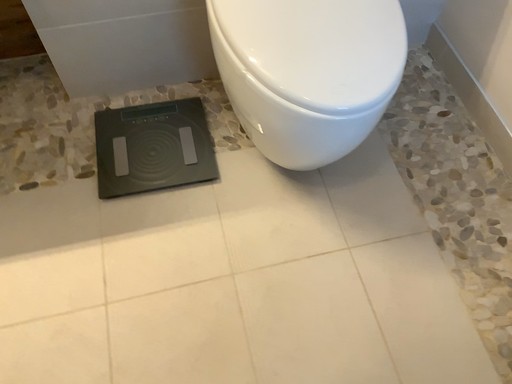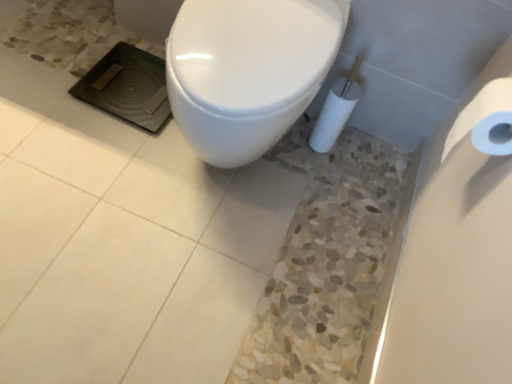
Question: How did the camera likely rotate when shooting the video?

Choices:
 (A) rotated downward
 (B) rotated upward

Answer: (B)